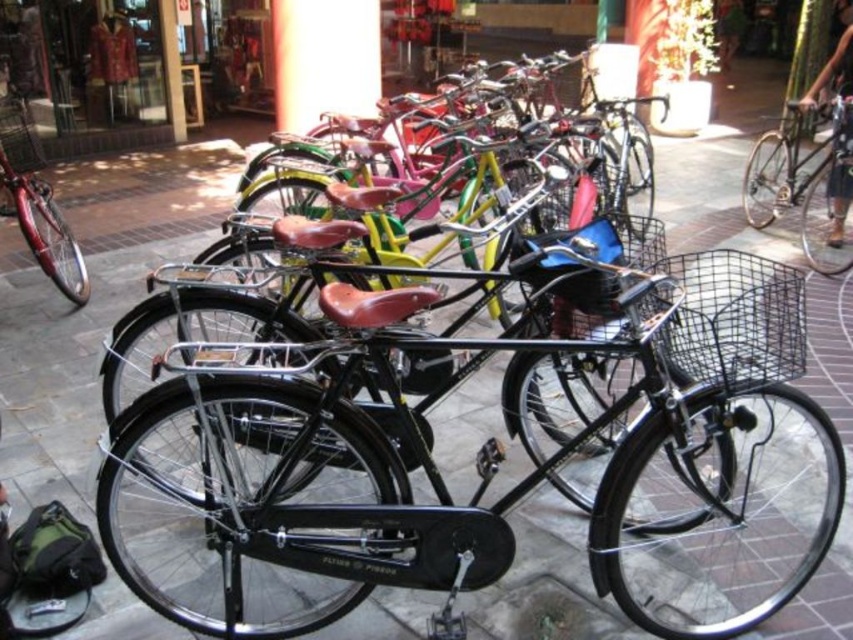
Question: Which point is closer to the camera?

Choices:
 (A) (41, 212)
 (B) (848, 177)

Answer: (A)

Question: Can you confirm if shiny silver bicycle at right is positioned to the right of shiny red bicycle at left?

Choices:
 (A) yes
 (B) no

Answer: (A)

Question: Among these objects, which one is nearest to the camera?

Choices:
 (A) shiny red bicycle at left
 (B) shiny silver bicycle at right

Answer: (A)

Question: Can you confirm if shiny silver bicycle at right is bigger than shiny red bicycle at left?

Choices:
 (A) no
 (B) yes

Answer: (B)

Question: Can you confirm if shiny silver bicycle at right is positioned to the right of shiny red bicycle at left?

Choices:
 (A) yes
 (B) no

Answer: (A)